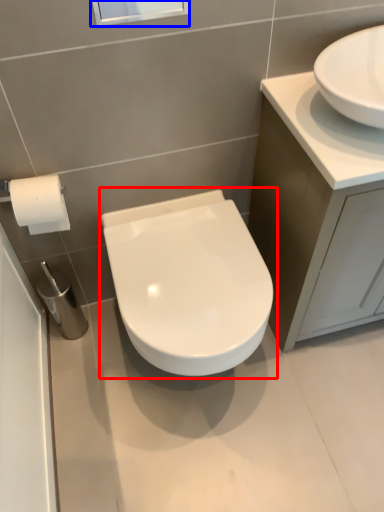
Question: Which object appears farthest to the camera in this image, toilet (highlighted by a red box) or window screen (highlighted by a blue box)?

Choices:
 (A) toilet
 (B) window screen

Answer: (A)